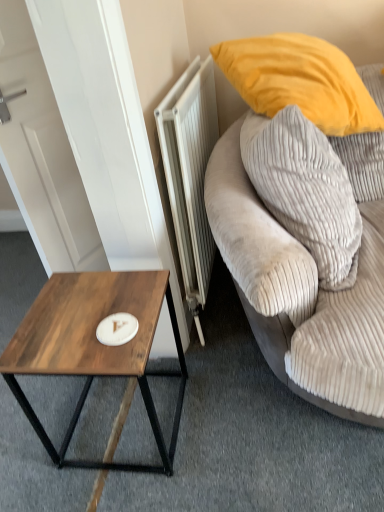
Question: Is velvet gray pillow at upper right behind wooden coffee table at lower left?

Choices:
 (A) no
 (B) yes

Answer: (A)

Question: Does velvet gray pillow at upper right have a lesser height compared to wooden coffee table at lower left?

Choices:
 (A) yes
 (B) no

Answer: (B)

Question: Is velvet gray pillow at upper right at the right side of wooden coffee table at lower left?

Choices:
 (A) no
 (B) yes

Answer: (B)

Question: Are velvet gray pillow at upper right and wooden coffee table at lower left far apart?

Choices:
 (A) yes
 (B) no

Answer: (B)

Question: Is velvet gray pillow at upper right thinner than wooden coffee table at lower left?

Choices:
 (A) no
 (B) yes

Answer: (B)

Question: Can you confirm if velvet gray pillow at upper right is bigger than wooden coffee table at lower left?

Choices:
 (A) no
 (B) yes

Answer: (B)

Question: Is white metallic radiator at center smaller than velvet gray pillow at upper right?

Choices:
 (A) yes
 (B) no

Answer: (A)

Question: Is white metallic radiator at center oriented towards velvet gray pillow at upper right?

Choices:
 (A) no
 (B) yes

Answer: (B)

Question: Considering the relative sizes of white metallic radiator at center and velvet gray pillow at upper right in the image provided, is white metallic radiator at center shorter than velvet gray pillow at upper right?

Choices:
 (A) yes
 (B) no

Answer: (B)

Question: Can you confirm if white metallic radiator at center is positioned to the right of velvet gray pillow at upper right?

Choices:
 (A) no
 (B) yes

Answer: (A)

Question: From a real-world perspective, is white metallic radiator at center under velvet gray pillow at upper right?

Choices:
 (A) yes
 (B) no

Answer: (A)

Question: Considering the relative positions of white metallic radiator at center and velvet gray pillow at upper right in the image provided, is white metallic radiator at center to the left of velvet gray pillow at upper right from the viewer's perspective?

Choices:
 (A) yes
 (B) no

Answer: (A)

Question: Is white metallic radiator at center surrounding white matte plate at center?

Choices:
 (A) yes
 (B) no

Answer: (B)